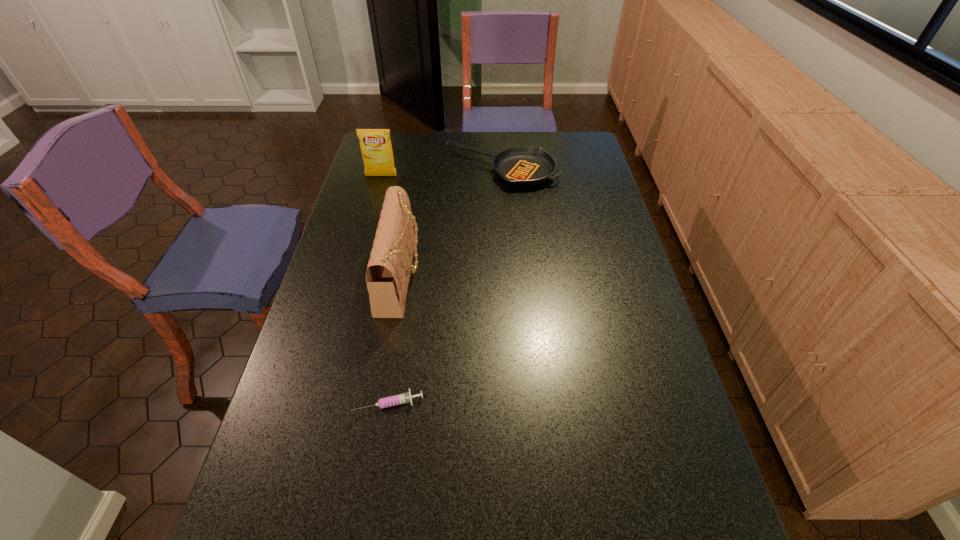
What are the coordinates of `free area in between the nearest object and the second shortest object` in the screenshot? It's located at (444, 286).

Point out which object is positioned as the third nearest to the third farthest object. Please provide its 2D coordinates. Your answer should be formatted as a tuple, i.e. [(x, y)], where the tuple contains the x and y coordinates of a point satisfying the conditions above.

[(376, 148)]

Select which object appears as the third closest to the handbag. Please provide its 2D coordinates. Your answer should be formatted as a tuple, i.e. [(x, y)], where the tuple contains the x and y coordinates of a point satisfying the conditions above.

[(376, 148)]

The height and width of the screenshot is (540, 960). I want to click on vacant point that satisfies the following two spatial constraints: 1. on the front-facing side of the nearest object; 2. on the left side of the second nearest object, so click(x=379, y=402).

The image size is (960, 540). I want to click on vacant area in the image that satisfies the following two spatial constraints: 1. on the front of the syringe with the logo; 2. on the right side of the leftmost object, so click(319, 402).

Find the location of a particular element. free spot that satisfies the following two spatial constraints: 1. on the front of the leftmost object with the logo; 2. on the right side of the shortest object is located at coordinates (319, 402).

Locate an element on the screen. The height and width of the screenshot is (540, 960). free space that satisfies the following two spatial constraints: 1. on the front-facing side of the handbag; 2. on the right side of the nearest object is located at coordinates (379, 402).

The image size is (960, 540). Find the location of `free region that satisfies the following two spatial constraints: 1. on the front-facing side of the nearest object; 2. on the left side of the second nearest object`. free region that satisfies the following two spatial constraints: 1. on the front-facing side of the nearest object; 2. on the left side of the second nearest object is located at coordinates (379, 402).